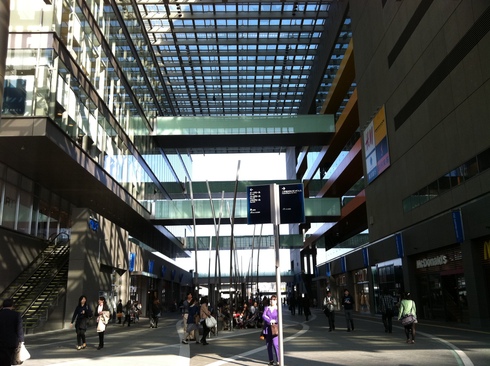
I want to click on staircase, so click(x=47, y=292).